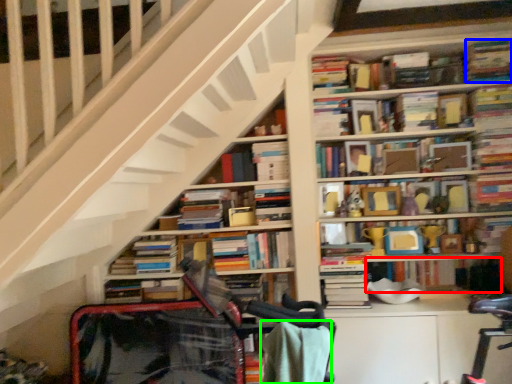
Question: Based on their relative distances, which object is farther from book (highlighted by a red box)? Choose from book (highlighted by a blue box) and blanket (highlighted by a green box).

Choices:
 (A) book
 (B) blanket

Answer: (B)